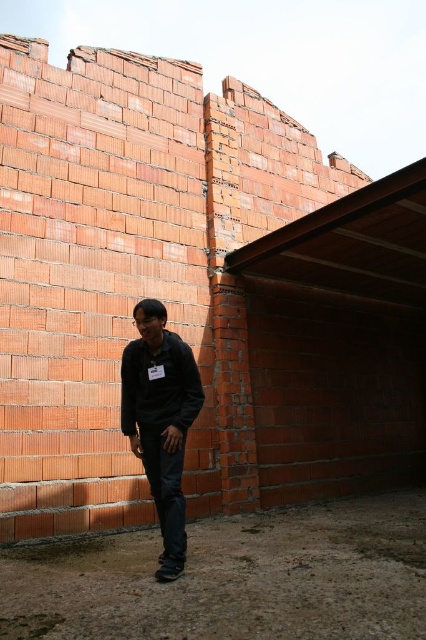
Question: Which point is closer to the camera taking this photo?

Choices:
 (A) (158, 374)
 (B) (149, 321)

Answer: (B)

Question: Can you confirm if black matte jacket at center is smaller than dark matte sweatshirt at center?

Choices:
 (A) no
 (B) yes

Answer: (A)

Question: Does black matte jacket at center have a smaller size compared to dark matte sweatshirt at center?

Choices:
 (A) no
 (B) yes

Answer: (A)

Question: In this image, where is black matte jacket at center located relative to dark matte sweatshirt at center?

Choices:
 (A) right
 (B) left

Answer: (A)